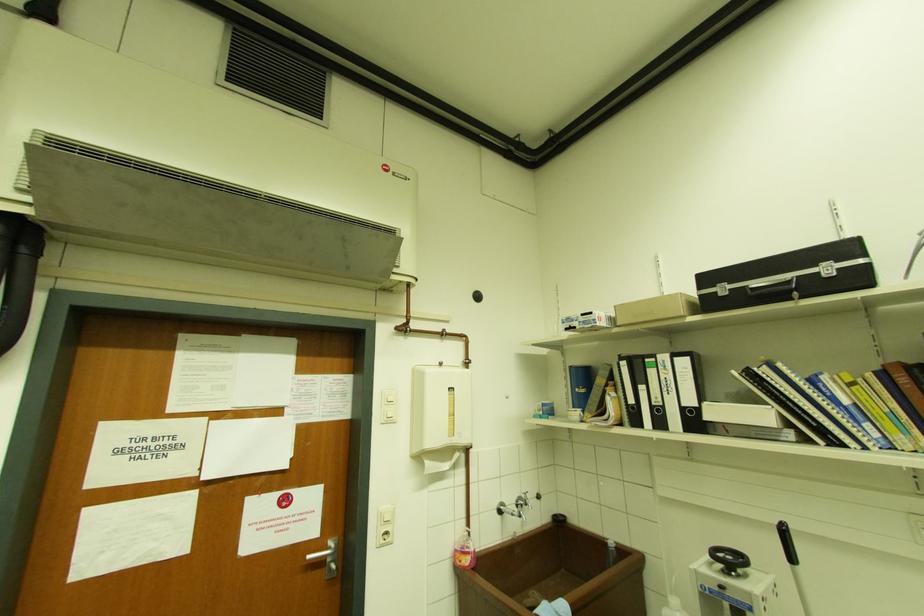
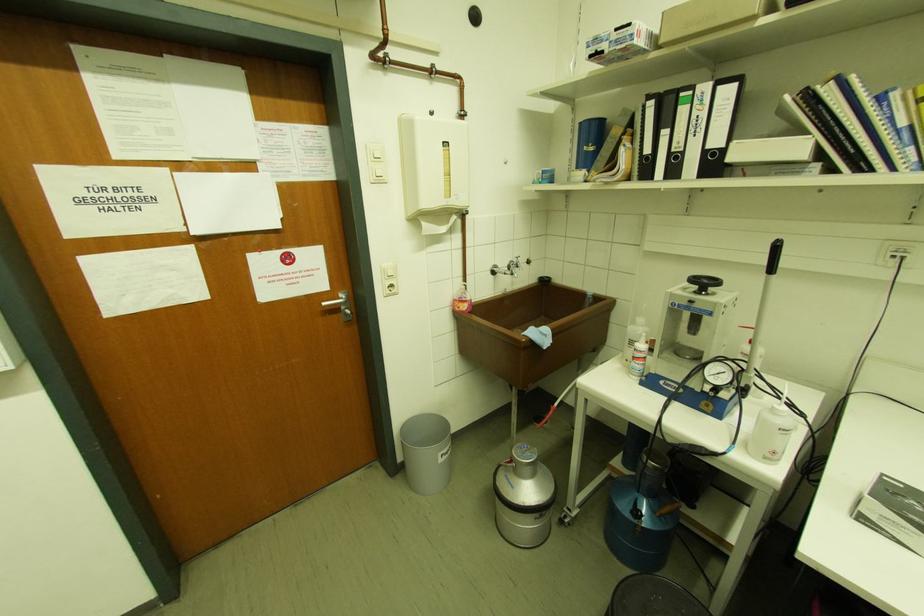
In the second image, find the point that corresponds to point 693,402 in the first image.

(720, 143)